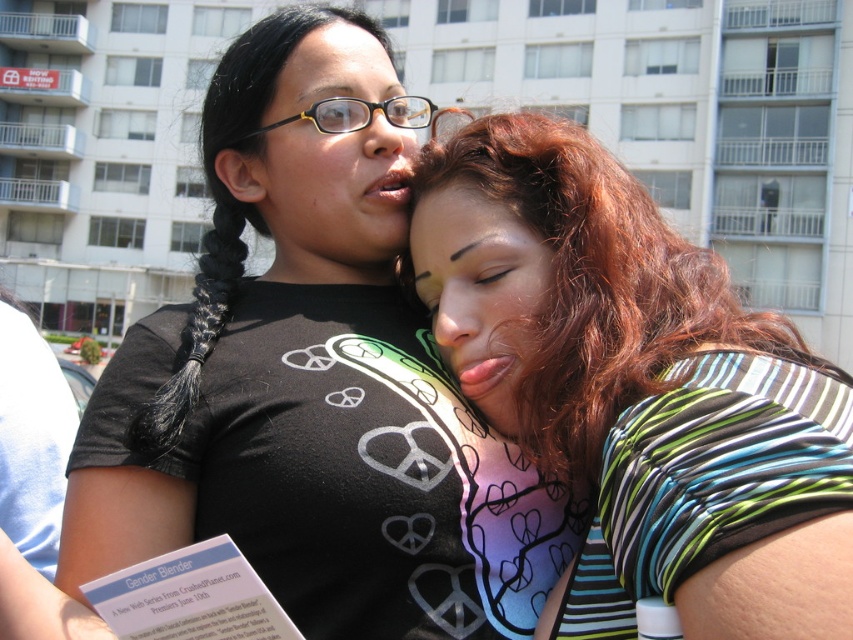
Looking at this image, you are a photographer trying to capture a closeup shot of the matte black glasses at upper center and the matte skin face at center. Since you want to focus on the glasses, which object should you zoom in on more, and why?

You should zoom in more on the matte black glasses at upper center because it is larger in size than the matte skin face at center, making it easier to focus on the glasses.

You are an artist sketching the scene and need to place the black matte shirt at upper left accurately. According to the coordinates provided, where should you position it on your 2D canvas?

The black matte shirt at upper left should be positioned at the coordinates point (312, 378) on the 2D canvas.